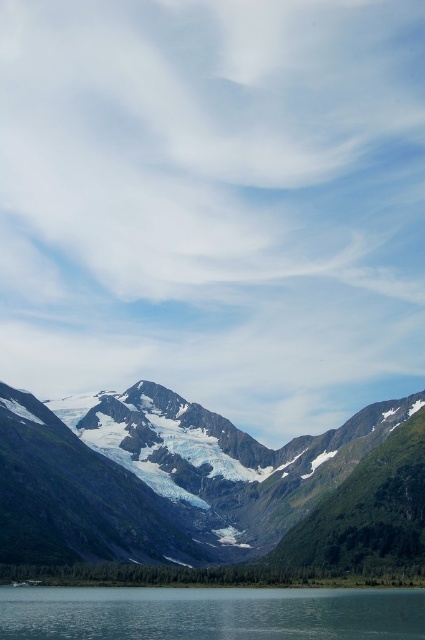
Between white snow-covered mountain at center and clear water at lower center, which one is positioned higher?

Positioned higher is white snow-covered mountain at center.

Does white snow-covered mountain at center have a greater height compared to clear water at lower center?

Indeed, white snow-covered mountain at center has a greater height compared to clear water at lower center.

Image resolution: width=425 pixels, height=640 pixels. In order to click on white snow-covered mountain at center in this screenshot , I will do `click(206, 484)`.